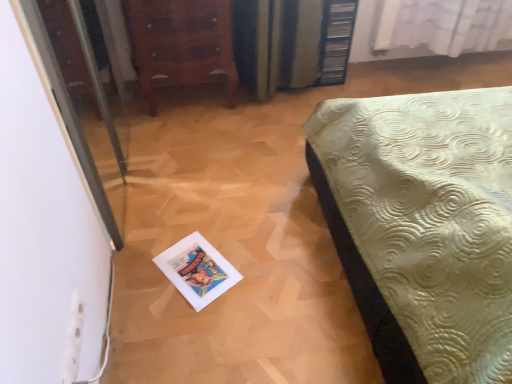
The height and width of the screenshot is (384, 512). I want to click on vacant space to the right of wooden chest of drawers at upper left, so point(262,116).